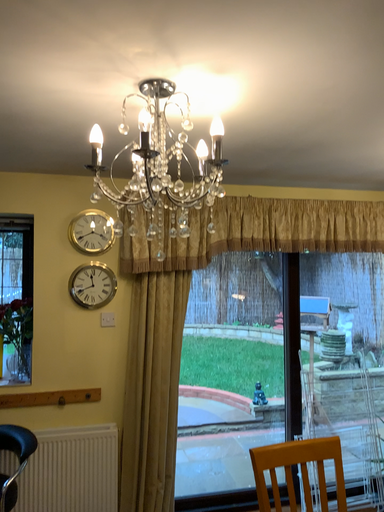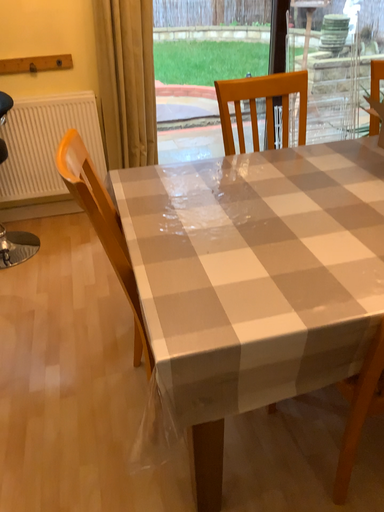
Question: Which way did the camera rotate in the video?

Choices:
 (A) rotated downward
 (B) rotated upward

Answer: (A)